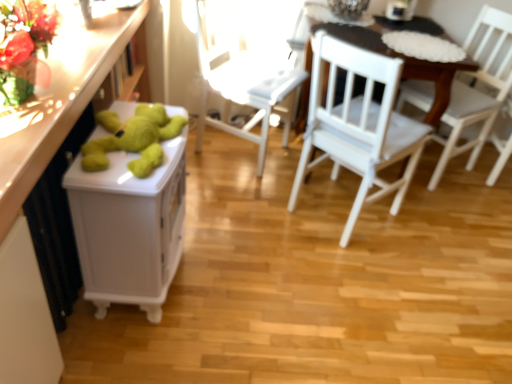
Measure the distance between green plush bear at left and camera.

green plush bear at left and camera are 3.81 feet apart from each other.

The image size is (512, 384). I want to click on green plush bear at left, so click(x=129, y=228).

You are a GUI agent. You are given a task and a screenshot of the screen. Output one action in this format:
    pyautogui.click(x=<x>, y=<y>)
    Task: Click on the white wood chair at center, the first chair positioned from the left
    
    Given the screenshot: What is the action you would take?
    pyautogui.click(x=247, y=66)

What do you see at coordinates (477, 91) in the screenshot? I see `white wood chair at right, which is the third chair from left to right` at bounding box center [477, 91].

Locate an element on the screen. The width and height of the screenshot is (512, 384). white wooden table at center is located at coordinates (432, 78).

The image size is (512, 384). Describe the element at coordinates (432, 78) in the screenshot. I see `white wooden table at center` at that location.

The height and width of the screenshot is (384, 512). In order to click on green plush toy at left in this screenshot , I will do `click(40, 175)`.

Which object is wider, white wooden table at center or white wood chair at center, the second chair from the left?

With larger width is white wooden table at center.

In the scene shown: Is white wooden table at center oriented towards white wood chair at center, the second chair from the left?

Yes, white wooden table at center faces towards white wood chair at center, the second chair from the left.

Is point (415, 62) in front of point (297, 195)?

Yes.

Find the location of `table directly beneath the white wood chair at center, which is the 2th chair from right to left (from a real-world perspective)`. table directly beneath the white wood chair at center, which is the 2th chair from right to left (from a real-world perspective) is located at coordinates (432, 78).

At what (x,y) coordinates should I click in order to perform the action: click on appliance that is under the white wood chair at center, the first chair positioned from the left (from a real-world perspective). Please return your answer as a coordinate pair (x, y). This screenshot has height=384, width=512. Looking at the image, I should click on (129, 228).

Between white wood chair at center, the 3th chair viewed from the right, and green plush bear at left, which one is positioned in front?

green plush bear at left.

What's the angular difference between white wood chair at center, the first chair positioned from the left, and green plush bear at left's facing directions?

The facing directions of white wood chair at center, the first chair positioned from the left, and green plush bear at left are 25.4 degrees apart.

Considering the sizes of objects white wood chair at center, the first chair positioned from the left, and green plush bear at left in the image provided, who is smaller, white wood chair at center, the first chair positioned from the left, or green plush bear at left?

green plush bear at left.

Does point (382, 59) come behind point (53, 53)?

Yes, point (382, 59) is behind point (53, 53).

From a real-world perspective, is white wood chair at center, the second chair from the left, physically above green plush toy at left?

Actually, white wood chair at center, the second chair from the left, is physically below green plush toy at left in the real world.

Is white wood chair at center, the second chair from the left, closer to the viewer compared to green plush toy at left?

No, white wood chair at center, the second chair from the left, is further to the viewer.

Considering the positions of objects white wood chair at center, which is the 2th chair from right to left, and green plush toy at left in the image provided, who is more to the right, white wood chair at center, which is the 2th chair from right to left, or green plush toy at left?

white wood chair at center, which is the 2th chair from right to left, is more to the right.

Considering the relative sizes of white wood chair at center, the 3th chair viewed from the right, and white wooden table at center in the image provided, is white wood chair at center, the 3th chair viewed from the right, thinner than white wooden table at center?

→ Indeed, white wood chair at center, the 3th chair viewed from the right, has a lesser width compared to white wooden table at center.

Considering the points (268, 100) and (445, 82), which point is in front, point (268, 100) or point (445, 82)?

Positioned in front is point (445, 82).

Between white wood chair at center, the 3th chair viewed from the right, and white wooden table at center, which one has larger size?

white wooden table at center is bigger.

Is point (234, 45) positioned after point (133, 117)?

Yes, it is.

Can we say white wood chair at center, the first chair positioned from the left, lies outside green plush bear at left?

That's correct, white wood chair at center, the first chair positioned from the left, is outside of green plush bear at left.

From a real-world perspective, is white wood chair at center, the first chair positioned from the left, above or below green plush bear at left?

Clearly, from a real-world perspective, white wood chair at center, the first chair positioned from the left, is below green plush bear at left.

This screenshot has height=384, width=512. What are the coordinates of `toy lying in front of the white wood chair at center, the first chair positioned from the left` in the screenshot? It's located at (133, 138).

Which object is thinner, green plush toy at left or green plush bear at left?

Thinner between the two is green plush toy at left.

Is green plush toy at left oriented away from green plush bear at left?

No, green plush bear at left is not at the back of green plush toy at left.

Is green plush toy at left bigger than green plush bear at left?

No.

How many degrees apart are the facing directions of green plush toy at left and green plush bear at left?

The angular difference between green plush toy at left and green plush bear at left is 1.38 degrees.

From the image's perspective, relative to white wood chair at right, which is counted as the first chair, starting from the right, is green plush bear at left above or below?

green plush bear at left is situated lower than white wood chair at right, which is counted as the first chair, starting from the right, in the image.

Is green plush bear at left not close to white wood chair at right, which is counted as the first chair, starting from the right?

That's right, there is a large distance between green plush bear at left and white wood chair at right, which is counted as the first chair, starting from the right.

Between green plush bear at left and white wood chair at right, which is the third chair from left to right, which one has smaller width?

With smaller width is green plush bear at left.

Is green plush bear at left to the right of white wood chair at right, which is the third chair from left to right, from the viewer's perspective?

In fact, green plush bear at left is to the left of white wood chair at right, which is the third chair from left to right.

The image size is (512, 384). In order to click on the 1st chair counting from the left side of the white wooden table at center in this screenshot , I will do `click(358, 125)`.

At what (x,y) coordinates should I click in order to perform the action: click on appliance lying below the white wood chair at center, the first chair positioned from the left (from the image's perspective). Please return your answer as a coordinate pair (x, y). The width and height of the screenshot is (512, 384). Looking at the image, I should click on (129, 228).

Considering their positions, is white wood chair at right, which is counted as the first chair, starting from the right, positioned further to white wood chair at center, the first chair positioned from the left, than white wood chair at center, which is the 2th chair from right to left?

white wood chair at right, which is counted as the first chair, starting from the right, is positioned further to the anchor white wood chair at center, the first chair positioned from the left.

Looking at the image, which one is located further to white wood chair at right, which is the third chair from left to right, white wood chair at center, the first chair positioned from the left, or green plush toy at left?

The object further to white wood chair at right, which is the third chair from left to right, is green plush toy at left.

Which object lies further to the anchor point green plush bear at left, white wood chair at center, the first chair positioned from the left, or white wood chair at center, the second chair from the left?

white wood chair at center, the first chair positioned from the left, lies further to green plush bear at left than the other object.

Looking at the image, which one is located closer to white wood chair at center, which is the 2th chair from right to left, green plush toy at left or white wood chair at right, which is counted as the first chair, starting from the right?

white wood chair at right, which is counted as the first chair, starting from the right, is closer to white wood chair at center, which is the 2th chair from right to left.

Based on their spatial positions, is green plush toy at left or white wood chair at center, the 3th chair viewed from the right, further from green plush bear at left?

Among the two, white wood chair at center, the 3th chair viewed from the right, is located further to green plush bear at left.

Considering their positions, is white wooden table at center positioned closer to green plush toy at left than green plush bear at left?

Among the two, green plush bear at left is located nearer to green plush toy at left.

Based on their spatial positions, is green plush toy at left or white wood chair at center, the 3th chair viewed from the right, closer to white wood chair at right, which is the third chair from left to right?

white wood chair at center, the 3th chair viewed from the right, lies closer to white wood chair at right, which is the third chair from left to right, than the other object.

Looking at the image, which one is located closer to white wood chair at right, which is counted as the first chair, starting from the right, white wooden table at center or green plush toy at left?

white wooden table at center is positioned closer to the anchor white wood chair at right, which is counted as the first chair, starting from the right.

I want to click on chair situated between white wood chair at center, the 3th chair viewed from the right, and white wooden table at center from left to right, so click(x=358, y=125).

Where is `table between white wood chair at center, which is the 2th chair from right to left, and white wood chair at right, which is counted as the first chair, starting from the right, from left to right`? Image resolution: width=512 pixels, height=384 pixels. table between white wood chair at center, which is the 2th chair from right to left, and white wood chair at right, which is counted as the first chair, starting from the right, from left to right is located at coordinates (432, 78).

Locate an element on the screen. The height and width of the screenshot is (384, 512). chair located between green plush bear at left and white wood chair at center, the second chair from the left, in the left-right direction is located at coordinates (247, 66).

Identify the location of toy situated between green plush toy at left and white wood chair at center, the second chair from the left, from left to right. (133, 138).